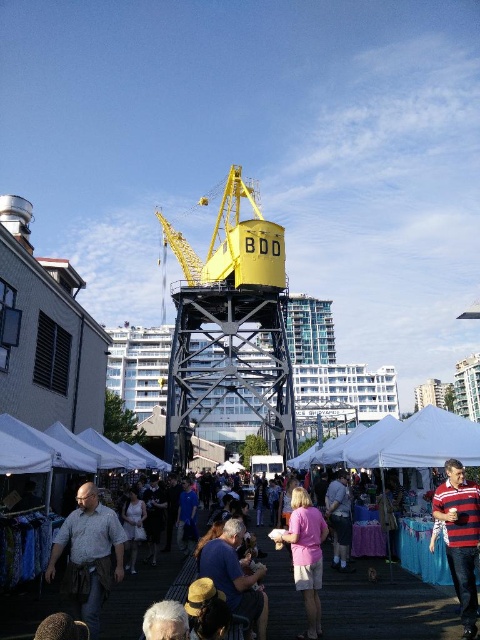
Question: Can you confirm if denim jacket at lower center is positioned below white satin dress at center?

Choices:
 (A) yes
 (B) no

Answer: (B)

Question: In this image, where is white fabric tents at center located relative to denim jacket at lower center?

Choices:
 (A) above
 (B) below

Answer: (A)

Question: Does white fabric tents at center appear on the right side of white satin dress at center?

Choices:
 (A) no
 (B) yes

Answer: (B)

Question: Among these points, which one is farthest from the camera?

Choices:
 (A) (129, 554)
 (B) (240, 582)
 (C) (327, 504)

Answer: (C)

Question: Which point is farther to the camera?

Choices:
 (A) (348, 618)
 (B) (216, 557)
 (C) (61, 529)
 (D) (127, 525)

Answer: (D)

Question: Which point appears farthest from the camera in this image?

Choices:
 (A) (412, 602)
 (B) (217, 534)

Answer: (B)